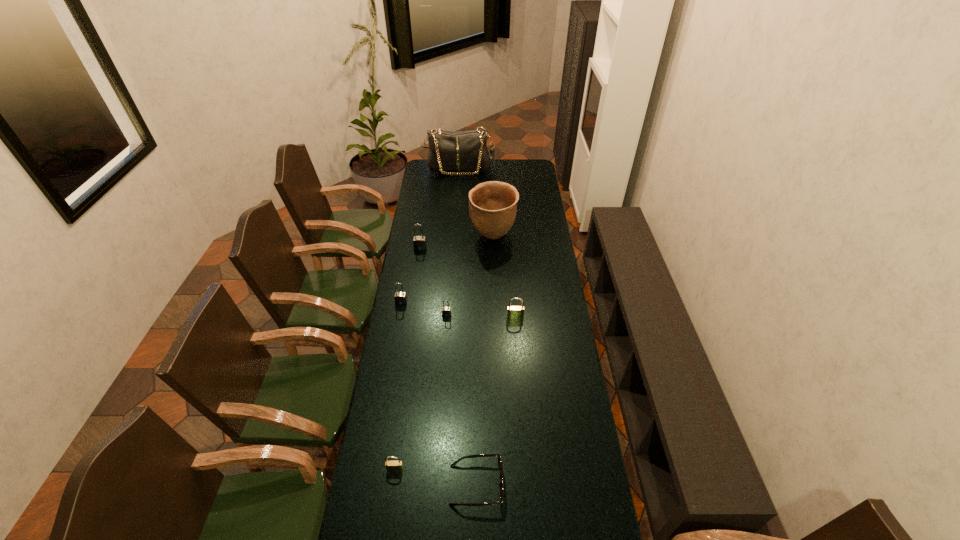
Where is `free space located on the lenses of the spectacles`? The image size is (960, 540). free space located on the lenses of the spectacles is located at coordinates (541, 485).

Where is `object present at the far edge`? This screenshot has width=960, height=540. object present at the far edge is located at coordinates (466, 151).

The width and height of the screenshot is (960, 540). I want to click on handbag that is at the left edge, so click(x=466, y=151).

Locate an element on the screen. The height and width of the screenshot is (540, 960). object present at the far left corner is located at coordinates (466, 151).

The width and height of the screenshot is (960, 540). In order to click on vacant space at the far edge of the desktop in this screenshot , I will do `click(496, 173)`.

In the image, there is a desktop. Identify the location of free space at the left edge. The image size is (960, 540). (434, 270).

I want to click on free spot at the right edge of the desktop, so click(532, 181).

Find the location of a particular element. free space at the far left corner of the desktop is located at coordinates (432, 178).

Locate an element on the screen. free spot at the far right corner of the desktop is located at coordinates (521, 164).

You are a GUI agent. You are given a task and a screenshot of the screen. Output one action in this format:
    pyautogui.click(x=<x>, y=<y>)
    Task: Click on the free area in between the shortest object and the farthest object
    Image resolution: width=960 pixels, height=540 pixels.
    Given the screenshot: What is the action you would take?
    pyautogui.click(x=468, y=327)